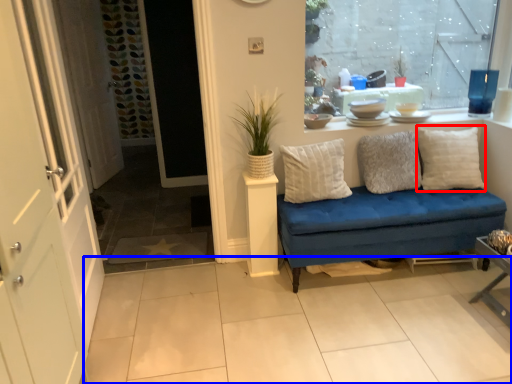
Question: Among these objects, which one is nearest to the camera, pillow (highlighted by a red box) or tile (highlighted by a blue box)?

Choices:
 (A) pillow
 (B) tile

Answer: (B)